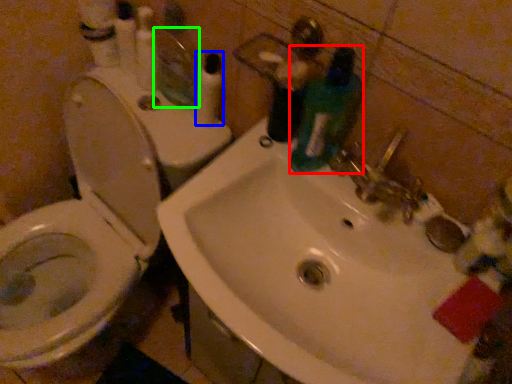
Question: Which is nearer to the cleaning product (highlighted by a red box)? toiletry (highlighted by a blue box) or mirror (highlighted by a green box).

Choices:
 (A) toiletry
 (B) mirror

Answer: (A)